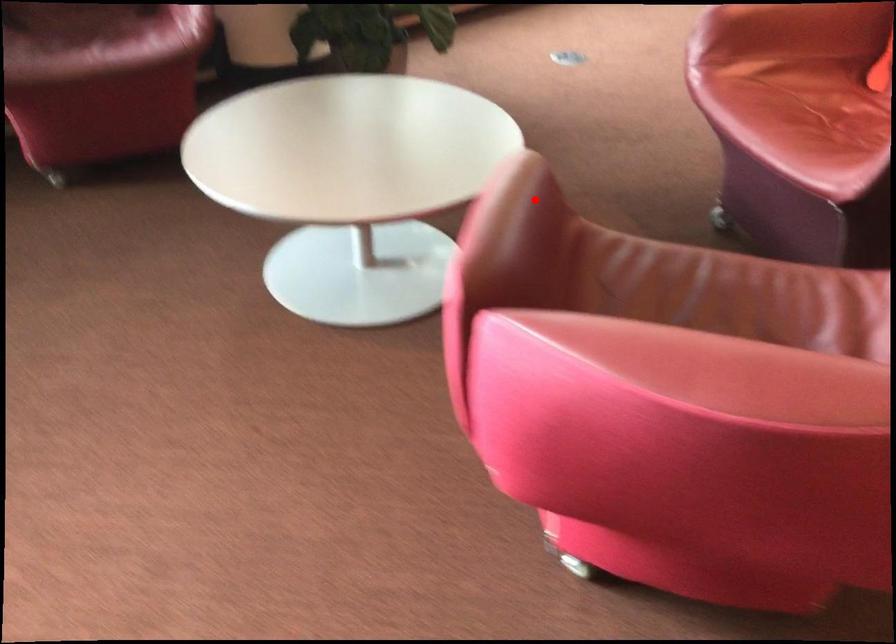
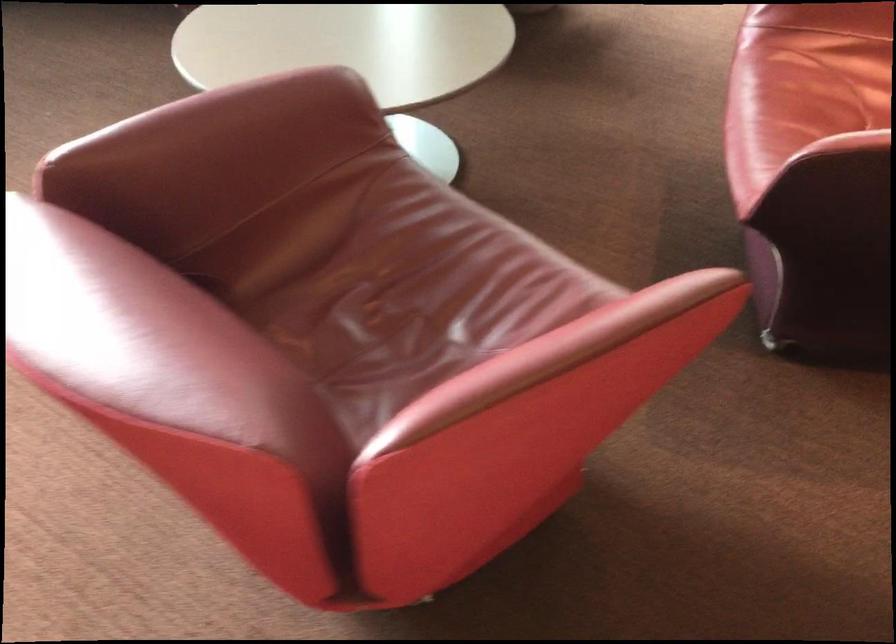
The point at the highlighted location is marked in the first image. Where is the corresponding point in the second image?

(255, 118)